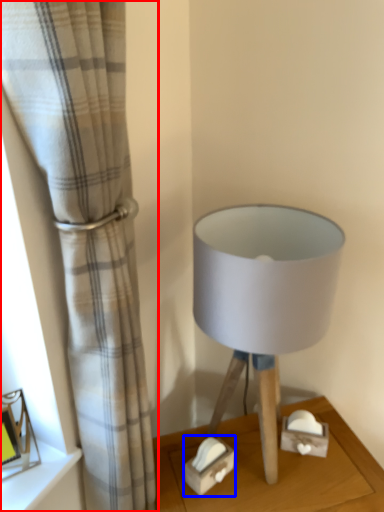
Question: Among these objects, which one is nearest to the camera, curtain (highlighted by a red box) or box (highlighted by a blue box)?

Choices:
 (A) curtain
 (B) box

Answer: (A)